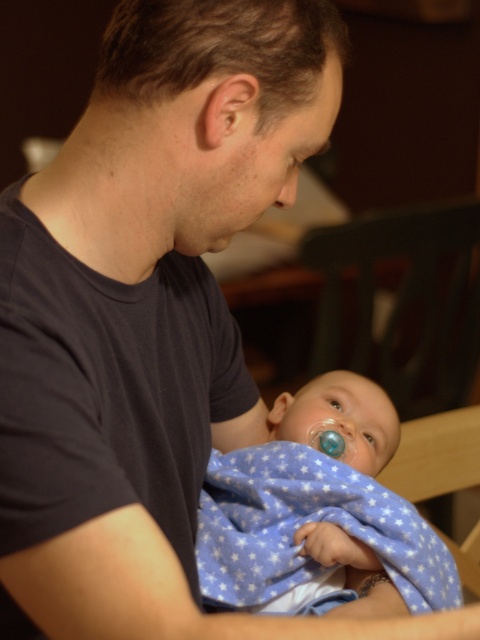
Which is more to the left, blue flannel blanket at center or translucent blue pacifier at center?

From the viewer's perspective, blue flannel blanket at center appears more on the left side.

The image size is (480, 640). Identify the location of blue flannel blanket at center. (305, 522).

Locate an element on the screen. The width and height of the screenshot is (480, 640). blue flannel blanket at center is located at coordinates (305, 522).